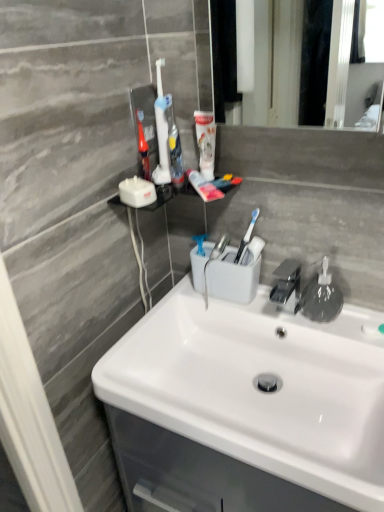
Question: Which direction should I rotate to face white plastic toothbrush at upper center, the first toothbrush when ordered from right to left, — up or down?

Choices:
 (A) up
 (B) down

Answer: (A)

Question: From a real-world perspective, is white glossy sink at center located higher than white plastic toothbrush at upper center, the second toothbrush positioned from the right?

Choices:
 (A) yes
 (B) no

Answer: (B)

Question: Can you confirm if white glossy sink at center is thinner than white plastic toothbrush at upper center, the second toothbrush positioned from the right?

Choices:
 (A) no
 (B) yes

Answer: (A)

Question: Can you confirm if white glossy sink at center is wider than white plastic toothbrush at upper center, the second toothbrush from the left?

Choices:
 (A) yes
 (B) no

Answer: (A)

Question: From a real-world perspective, is white glossy sink at center located beneath white plastic toothbrush at upper center, the second toothbrush positioned from the right?

Choices:
 (A) no
 (B) yes

Answer: (B)

Question: Considering the relative sizes of white glossy sink at center and white plastic toothbrush at upper center, the second toothbrush positioned from the right, in the image provided, is white glossy sink at center smaller than white plastic toothbrush at upper center, the second toothbrush positioned from the right,?

Choices:
 (A) no
 (B) yes

Answer: (A)

Question: Considering the relative sizes of white glossy sink at center and white plastic toothbrush at upper center, the second toothbrush positioned from the right, in the image provided, is white glossy sink at center shorter than white plastic toothbrush at upper center, the second toothbrush positioned from the right,?

Choices:
 (A) yes
 (B) no

Answer: (A)

Question: Can you confirm if white plastic toothbrush at upper center, the first toothbrush when ordered from right to left, is thinner than white glossy sink at center?

Choices:
 (A) no
 (B) yes

Answer: (B)

Question: Is white glossy sink at center surrounded by white plastic toothbrush at upper center, the first toothbrush when ordered from right to left?

Choices:
 (A) yes
 (B) no

Answer: (B)

Question: Is white plastic toothbrush at upper center, the first toothbrush when ordered from right to left, at the right side of white glossy sink at center?

Choices:
 (A) no
 (B) yes

Answer: (A)

Question: From a real-world perspective, is white plastic toothbrush at upper center, placed as the third toothbrush when sorted from left to right, physically above white glossy sink at center?

Choices:
 (A) no
 (B) yes

Answer: (B)

Question: Is white plastic toothbrush at upper center, placed as the third toothbrush when sorted from left to right, looking in the opposite direction of white glossy sink at center?

Choices:
 (A) yes
 (B) no

Answer: (B)

Question: Is white plastic toothbrush at upper center, placed as the third toothbrush when sorted from left to right, taller than white glossy sink at center?

Choices:
 (A) yes
 (B) no

Answer: (B)

Question: From the image's perspective, is translucent plastic toothbrush at upper center, which ranks as the 3th toothbrush in right-to-left order, located above white plastic toothbrush at upper center, placed as the third toothbrush when sorted from left to right?

Choices:
 (A) yes
 (B) no

Answer: (B)